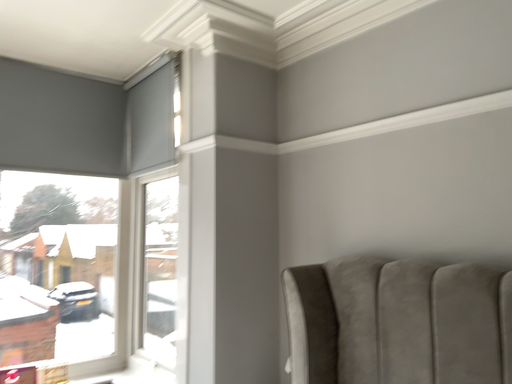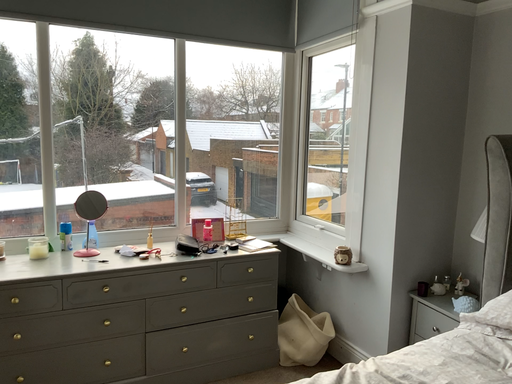
Question: Which way did the camera rotate in the video?

Choices:
 (A) rotated right
 (B) rotated left

Answer: (B)